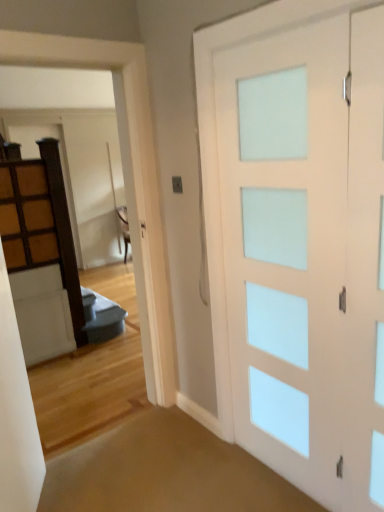
Question: Is white frosted glass door at upper center positioned behind wooden cabinet at left?

Choices:
 (A) yes
 (B) no

Answer: (B)

Question: From the image's perspective, is white frosted glass door at upper center over wooden cabinet at left?

Choices:
 (A) no
 (B) yes

Answer: (A)

Question: Does white frosted glass door at upper center have a greater height compared to wooden cabinet at left?

Choices:
 (A) yes
 (B) no

Answer: (A)

Question: Is there a large distance between white frosted glass door at upper center and wooden cabinet at left?

Choices:
 (A) yes
 (B) no

Answer: (A)

Question: Can you confirm if white frosted glass door at upper center is positioned to the right of wooden cabinet at left?

Choices:
 (A) yes
 (B) no

Answer: (A)

Question: From a real-world perspective, is white frosted glass door at upper center positioned above or below wooden cabinet at left?

Choices:
 (A) below
 (B) above

Answer: (A)

Question: Do you think white frosted glass door at upper center is within wooden cabinet at left, or outside of it?

Choices:
 (A) outside
 (B) inside

Answer: (A)

Question: Is white frosted glass door at upper center taller or shorter than wooden cabinet at left?

Choices:
 (A) short
 (B) tall

Answer: (B)

Question: Based on their positions, is white frosted glass door at upper center located to the left or right of wooden cabinet at left?

Choices:
 (A) left
 (B) right

Answer: (B)

Question: Considering the relative positions of white frosted glass door at upper center and white frosted glass barn door at right in the image provided, is white frosted glass door at upper center to the left or to the right of white frosted glass barn door at right?

Choices:
 (A) right
 (B) left

Answer: (B)

Question: From the image's perspective, relative to white frosted glass barn door at right, is white frosted glass door at upper center above or below?

Choices:
 (A) above
 (B) below

Answer: (A)

Question: Is white frosted glass door at upper center inside the boundaries of white frosted glass barn door at right, or outside?

Choices:
 (A) outside
 (B) inside

Answer: (A)

Question: Does point (152, 368) appear closer or farther from the camera than point (249, 121)?

Choices:
 (A) farther
 (B) closer

Answer: (A)

Question: Is point (4, 256) positioned closer to the camera than point (155, 196)?

Choices:
 (A) farther
 (B) closer

Answer: (A)

Question: Considering the positions of wooden cabinet at left and white frosted glass door at upper center in the image, is wooden cabinet at left taller or shorter than white frosted glass door at upper center?

Choices:
 (A) short
 (B) tall

Answer: (A)